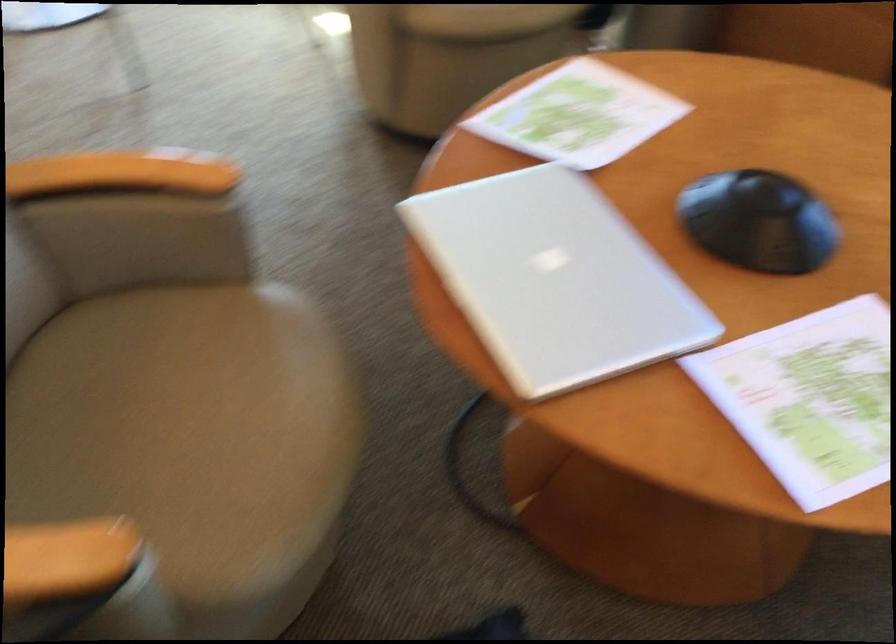
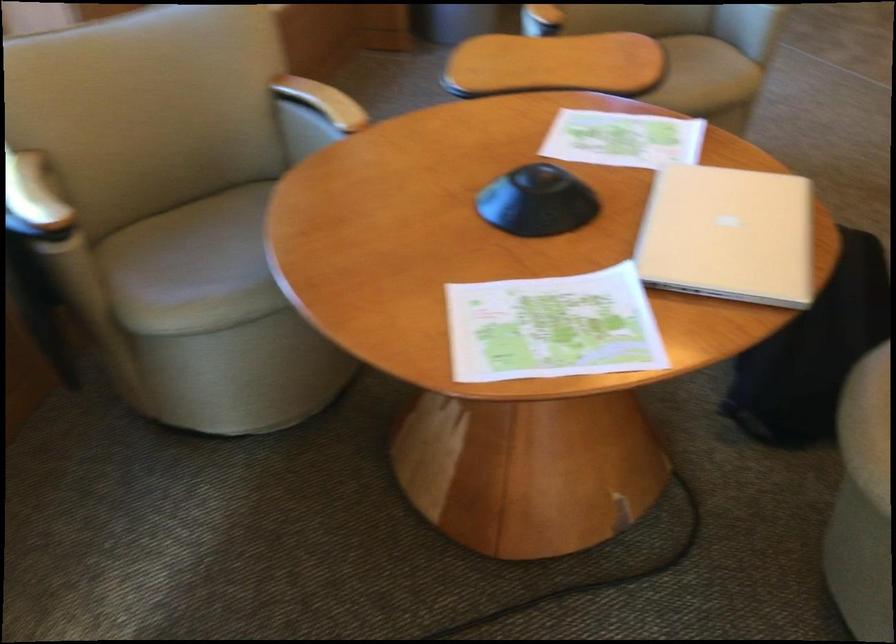
In the second image, find the point that corresponds to the point at 471,310 in the first image.

(728, 236)